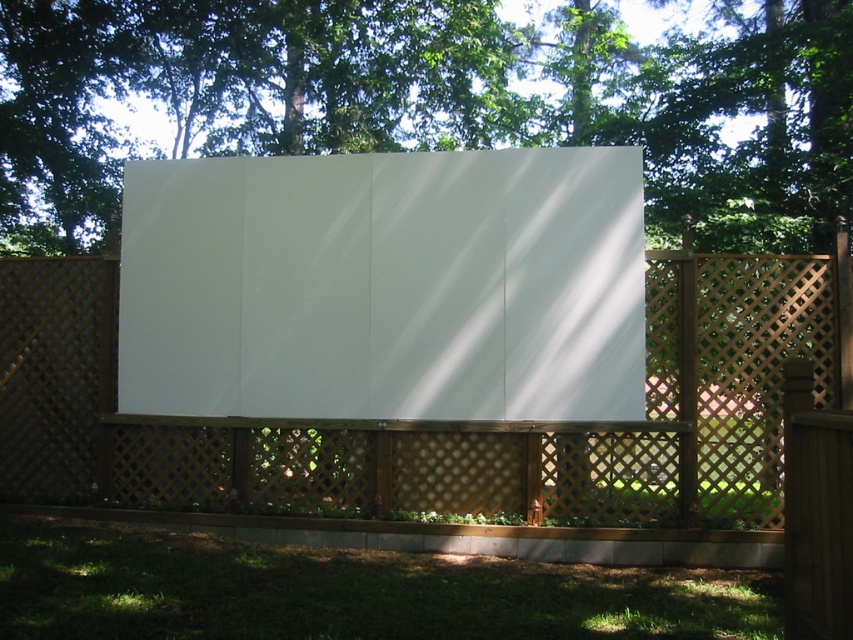
You are setting up a projector in the backyard and need to aim it at the white matte billboard at center. Since the wooden lattice fence at center is in the way, will you need to adjust the projector angle upwards or downwards to avoid the fence?

The white matte billboard at center is located above the wooden lattice fence at center, so you will need to adjust the projector angle upwards to aim at the billboard without obstruction from the fence.

Based on the photo, you are planning to hang a large banner between the green leafy tree at upper center and the wooden lattice fence at center. Based on their sizes, which object would provide a more stable support point for the banner?

The green leafy tree at upper center has a larger size compared to the wooden lattice fence at center, so it would provide a more stable support point for the banner.